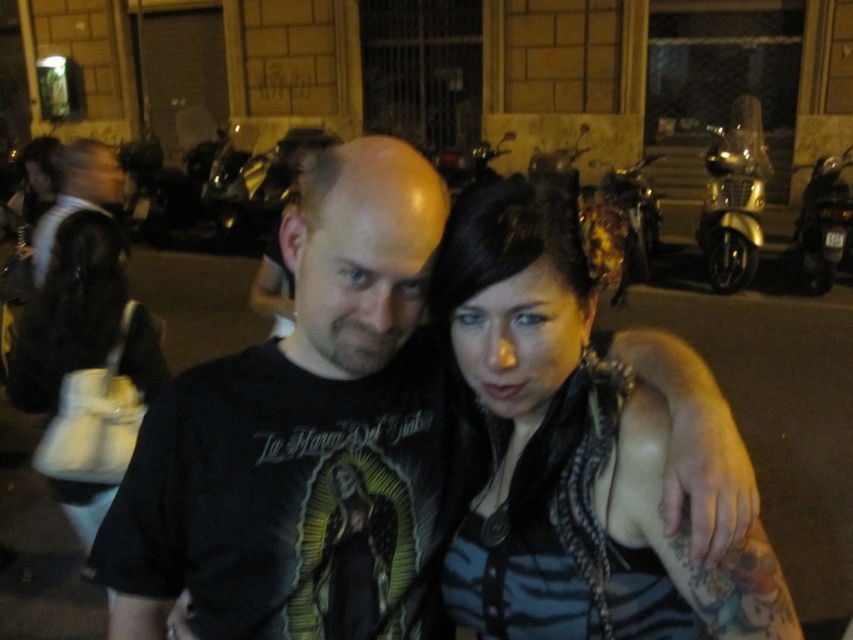
You are a delivery person who needs to pick up a dark brown leather jacket at center from the ground. The jacket is placed on the ground in the image. You are currently standing 34.93 inches away from it. Can you reach the jacket without moving your feet?

The dark brown leather jacket at center is 34.93 inches away from the viewer. Since the average human arm length is about 25 to 30 inches, you would need to move your feet to reach it.

You are standing in the nighttime urban scene described. You want to reach the gold metallic scooter at upper right. Considering the distance, can you comfortably walk to it without any obstacles?

The gold metallic scooter at upper right is 23.30 feet away from you, so yes, you can comfortably walk to it as the distance is manageable and there are no mentioned obstacles in the scene.